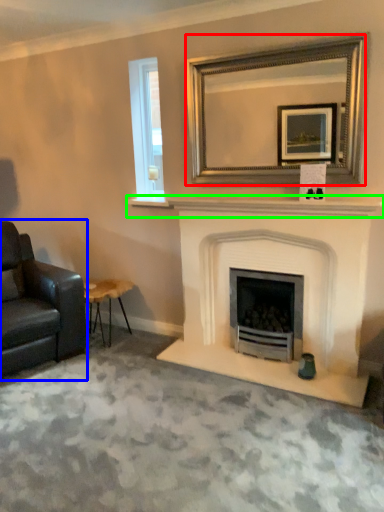
Question: Which object is the closest to the mirror (highlighted by a red box)? Choose among these: chair (highlighted by a blue box) or mantle (highlighted by a green box).

Choices:
 (A) chair
 (B) mantle

Answer: (B)